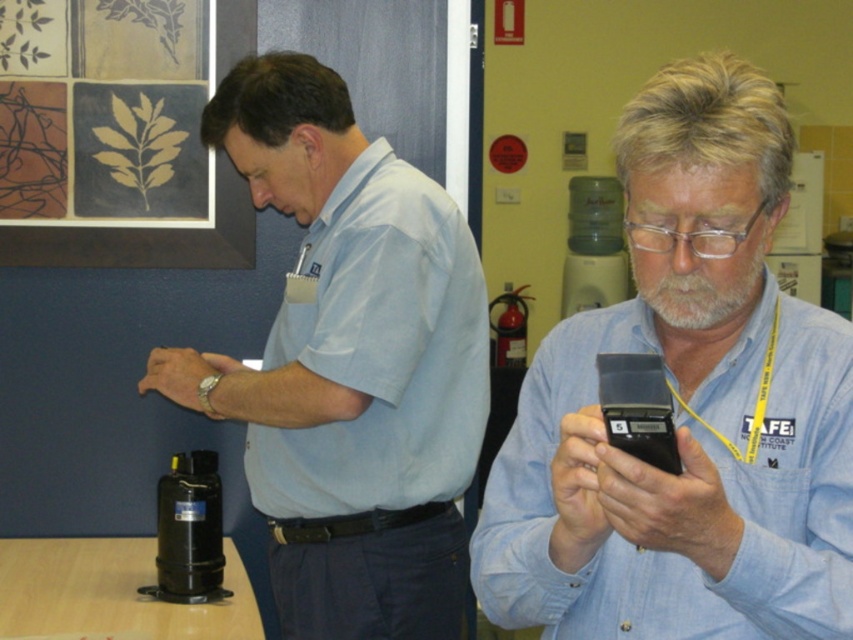
Between light blue shirt at center and black plastic smartphone at center, which one is positioned higher?

A: light blue shirt at center is above.

Does point (276, 70) come behind point (605, 429)?

Yes, it is.

Is point (408, 499) positioned before point (635, 406)?

No, (408, 499) is further to viewer.

Identify the location of light blue shirt at center. This screenshot has height=640, width=853. (350, 365).

In the scene shown: Is the position of blue denim shirt at center less distant than that of light blue cotton shirt at center?

Yes, it is.

How much distance is there between blue denim shirt at center and light blue cotton shirt at center?

A distance of 25.05 inches exists between blue denim shirt at center and light blue cotton shirt at center.

Is point (793, 387) positioned in front of point (416, 369)?

Yes, point (793, 387) is closer to viewer.

What are the coordinates of `blue denim shirt at center` in the screenshot? It's located at (686, 406).

Can you confirm if light blue shirt at center is bigger than light blue cotton shirt at center?

Yes.

Measure the distance between point (291, 378) and camera.

Point (291, 378) and camera are 1.76 meters apart from each other.

Describe the element at coordinates (350, 365) in the screenshot. I see `light blue shirt at center` at that location.

Find the location of a particular element. This screenshot has height=640, width=853. light blue shirt at center is located at coordinates [350, 365].